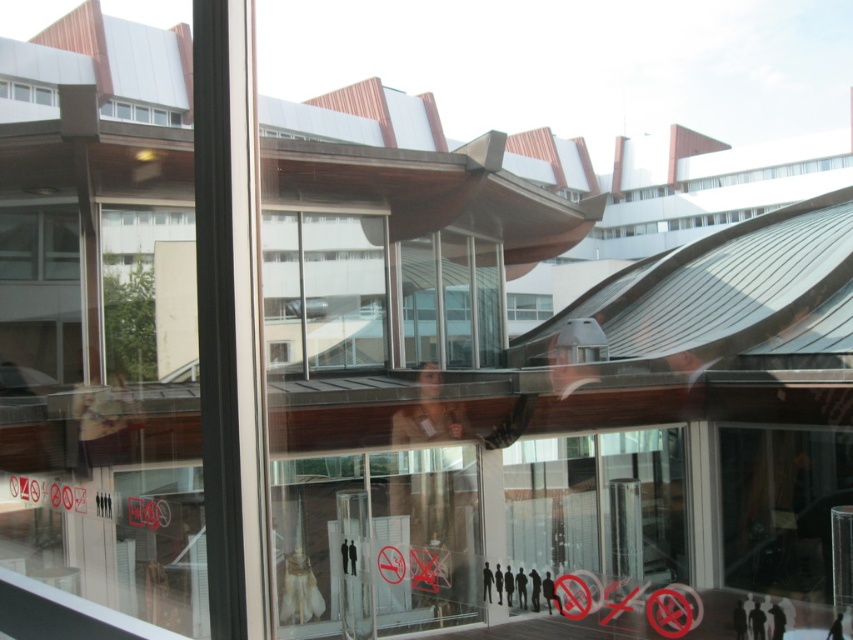
Question: Is transparent glass door at center to the left of clear glass window at upper left from the viewer's perspective?

Choices:
 (A) no
 (B) yes

Answer: (A)

Question: Estimate the real-world distances between objects in this image. Which object is closer to the transparent glass door at center?

Choices:
 (A) clear glass window at upper center
 (B) clear glass window at upper left

Answer: (B)

Question: Among these points, which one is farthest from the camera?

Choices:
 (A) tap(364, 513)
 (B) tap(27, 84)
 (C) tap(160, 109)

Answer: (C)

Question: Is transparent glass door at center bigger than clear glass window at upper left?

Choices:
 (A) yes
 (B) no

Answer: (A)

Question: Where is clear glass window at upper center located in relation to clear glass window at upper left in the image?

Choices:
 (A) below
 (B) above

Answer: (B)

Question: Considering the real-world distances, which object is farthest from the clear glass window at upper left?

Choices:
 (A) transparent glass door at center
 (B) clear glass window at upper center

Answer: (A)